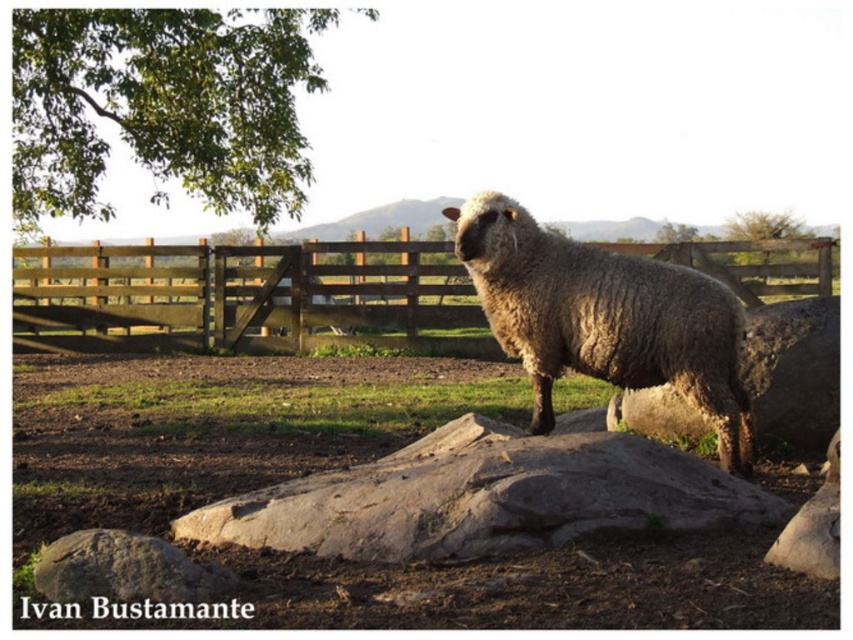
Can you confirm if wooden gate at center is thinner than fuzzy woolly sheep at center?

Incorrect, wooden gate at center's width is not less than fuzzy woolly sheep at center's.

Does wooden gate at center have a greater width compared to fuzzy woolly sheep at center?

Yes.

Measure the distance between wooden gate at center and camera.

wooden gate at center is 45.64 feet from camera.

Identify the location of wooden gate at center. The image size is (853, 640). (241, 296).

Does green leafy tree at upper left have a smaller size compared to gray rough rock at center?

Yes, green leafy tree at upper left is smaller than gray rough rock at center.

Is green leafy tree at upper left thinner than gray rough rock at center?

Correct, green leafy tree at upper left's width is less than gray rough rock at center's.

Between point (221, 189) and point (589, 532), which one is positioned behind?

The point (221, 189) is behind.

In order to click on green leafy tree at upper left in this screenshot , I will do `click(163, 106)`.

Is green leafy tree at upper left thinner than fuzzy woolly sheep at center?

Indeed, green leafy tree at upper left has a lesser width compared to fuzzy woolly sheep at center.

Between green leafy tree at upper left and fuzzy woolly sheep at center, which one appears on the right side from the viewer's perspective?

fuzzy woolly sheep at center

Who is more distant from viewer, (51,58) or (735,403)?

Positioned behind is point (51,58).

This screenshot has width=853, height=640. I want to click on green leafy tree at upper left, so click(163, 106).